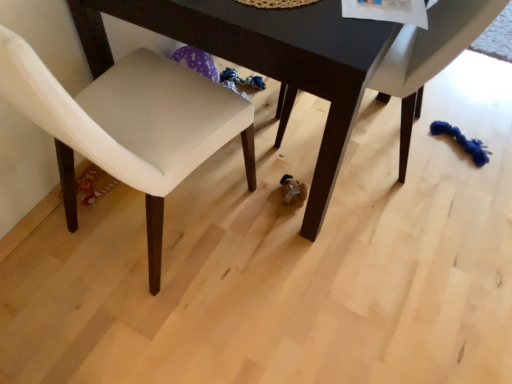
Find the location of a particular element. vacant space in front of dark wood table at center is located at coordinates (278, 297).